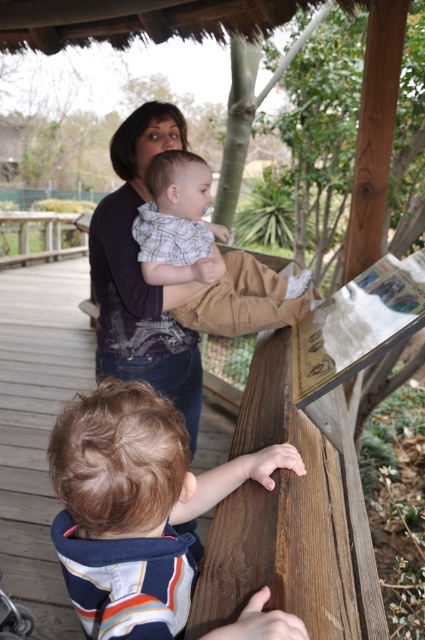
You are a photographer trying to capture a candid shot of the brown textured hair at upper center and the light brown cotton pants at upper center. Which object should you focus on first if you want to ensure both are in focus?

The light brown cotton pants at upper center should be focused on first since it is above the brown textured hair at upper center, allowing the photographer to adjust focus from near to far or vice versa while ensuring both are in frame.

You are a photographer trying to capture the two subjects at the wooden railing. Since the brown textured hair at upper center and the matte black shirt at upper center are both in the frame, which one appears narrower in the photo?

The brown textured hair at upper center appears narrower in the photo because it is thinner than the matte black shirt at upper center.